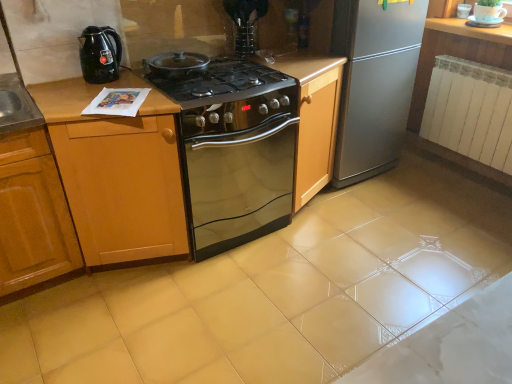
Question: Is stainless steel oven at center at the left side of white glossy cup at upper right, which appears as the second appliance when viewed from the front?

Choices:
 (A) yes
 (B) no

Answer: (A)

Question: Is stainless steel oven at center bigger than white glossy cup at upper right, which is the 1th appliance from right to left?

Choices:
 (A) yes
 (B) no

Answer: (A)

Question: Is stainless steel oven at center smaller than white glossy cup at upper right, placed as the first appliance when sorted from top to bottom?

Choices:
 (A) yes
 (B) no

Answer: (B)

Question: From the image's perspective, is stainless steel oven at center located above white glossy cup at upper right, placed as the first appliance when sorted from top to bottom?

Choices:
 (A) no
 (B) yes

Answer: (A)

Question: Can you confirm if stainless steel oven at center is taller than white glossy cup at upper right, the first appliance positioned from the back?

Choices:
 (A) no
 (B) yes

Answer: (B)

Question: Considering the relative positions of black glass cooktop at center and silver metallic refrigerator at right in the image provided, is black glass cooktop at center to the left or to the right of silver metallic refrigerator at right?

Choices:
 (A) right
 (B) left

Answer: (B)

Question: Based on their sizes in the image, would you say black glass cooktop at center is bigger or smaller than silver metallic refrigerator at right?

Choices:
 (A) small
 (B) big

Answer: (A)

Question: Relative to silver metallic refrigerator at right, is black glass cooktop at center in front or behind?

Choices:
 (A) front
 (B) behind

Answer: (A)

Question: Is point (170, 99) positioned closer to the camera than point (391, 33)?

Choices:
 (A) closer
 (B) farther

Answer: (A)

Question: In terms of width, does clear glass vase at upper center, which is the 2th appliance from right to left, look wider or thinner when compared to wooden cabinet at left, the 1th cabinetry in the left-to-right sequence?

Choices:
 (A) thin
 (B) wide

Answer: (A)

Question: Considering their positions, is clear glass vase at upper center, the 2th appliance viewed from the back, located in front of or behind wooden cabinet at left, which appears as the second cabinetry when viewed from the right?

Choices:
 (A) behind
 (B) front

Answer: (A)

Question: Would you say clear glass vase at upper center, positioned as the first appliance in bottom-to-top order, is to the left or to the right of wooden cabinet at left, which appears as the second cabinetry when viewed from the right, in the picture?

Choices:
 (A) left
 (B) right

Answer: (B)

Question: Is point [244, 36] closer or farther from the camera than point [45, 263]?

Choices:
 (A) farther
 (B) closer

Answer: (A)

Question: Considering the positions of wooden cabinet at center, the first cabinetry when ordered from right to left, and wooden cabinet at left, which appears as the second cabinetry when viewed from the right, in the image, is wooden cabinet at center, the first cabinetry when ordered from right to left, taller or shorter than wooden cabinet at left, which appears as the second cabinetry when viewed from the right,?

Choices:
 (A) short
 (B) tall

Answer: (B)

Question: In terms of size, does wooden cabinet at center, the first cabinetry when ordered from right to left, appear bigger or smaller than wooden cabinet at left, which appears as the second cabinetry when viewed from the right?

Choices:
 (A) small
 (B) big

Answer: (B)